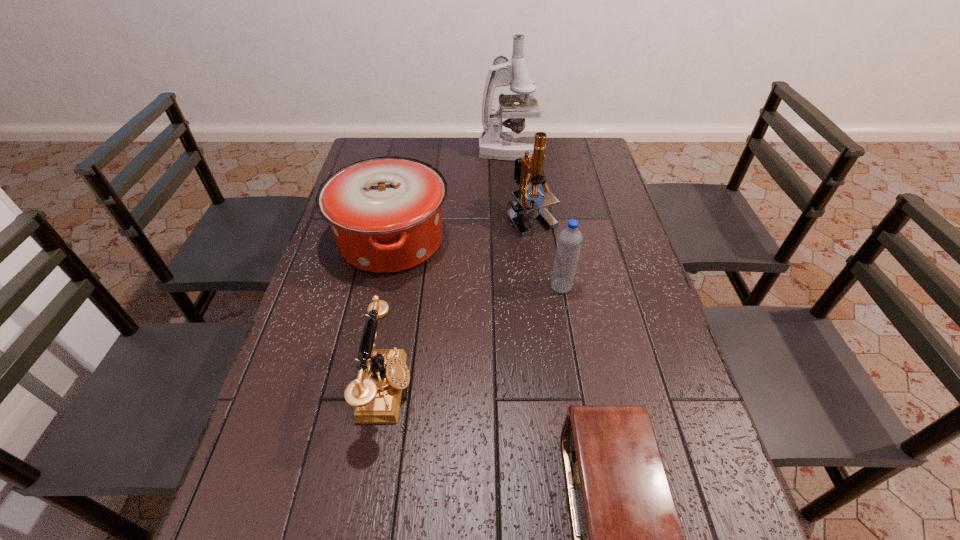
Where is `free point located 0.120m on the back of the water bottle`? free point located 0.120m on the back of the water bottle is located at coordinates (555, 249).

This screenshot has width=960, height=540. What are the coordinates of `vacant point located 0.380m on the dial of the telephone` in the screenshot? It's located at (586, 389).

This screenshot has height=540, width=960. I want to click on object at the far edge, so click(493, 143).

In order to click on object situated at the left edge in this screenshot , I will do `click(385, 213)`.

Where is `vacant space at the far edge of the desktop`? The height and width of the screenshot is (540, 960). vacant space at the far edge of the desktop is located at coordinates (420, 137).

In the image, there is a desktop. Where is `vacant space at the left edge`? The image size is (960, 540). vacant space at the left edge is located at coordinates (270, 496).

This screenshot has width=960, height=540. In the image, there is a desktop. In order to click on vacant space at the right edge in this screenshot , I will do `click(662, 383)`.

The image size is (960, 540). I want to click on vacant space at the far left corner of the desktop, so click(380, 152).

Identify the location of vacant space at the far right corner of the desktop. This screenshot has width=960, height=540. (587, 142).

Locate an element on the screen. free space that is in between the fifth tallest object and the casserole is located at coordinates (389, 315).